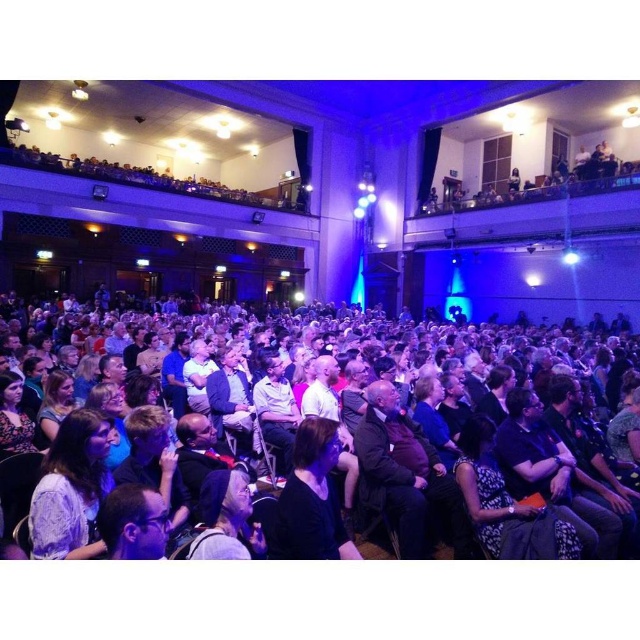
Question: Which object is farther from the camera taking this photo?

Choices:
 (A) black matte shirt at center
 (B) light purple lace dress at lower left
 (C) dark brown leather jacket at center

Answer: (A)

Question: From the image, what is the correct spatial relationship of dark clothing crowd at center in relation to light purple lace dress at lower left?

Choices:
 (A) above
 (B) below

Answer: (A)

Question: Does dark clothing crowd at center have a lesser width compared to black matte shirt at center?

Choices:
 (A) no
 (B) yes

Answer: (A)

Question: Which is nearer to the dark clothing crowd at center?

Choices:
 (A) black matte shirt at center
 (B) light purple lace dress at lower left

Answer: (B)

Question: Based on their relative distances, which object is nearer to the light purple lace dress at lower left?

Choices:
 (A) black matte shirt at center
 (B) dark brown leather jacket at center
 (C) dark clothing crowd at center

Answer: (B)

Question: Does black matte shirt at center appear under dark brown leather jacket at center?

Choices:
 (A) yes
 (B) no

Answer: (B)